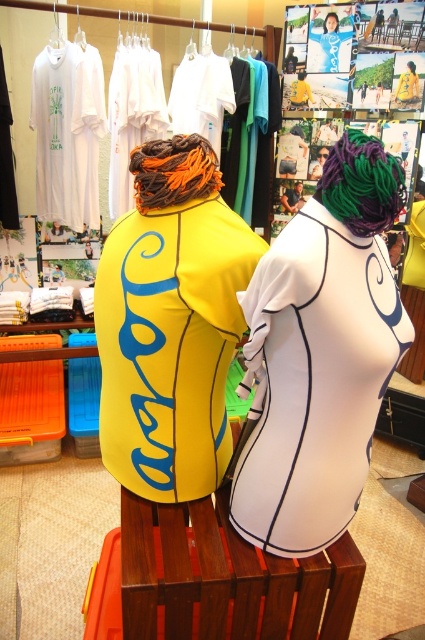
Question: Which point is closer to the camera?

Choices:
 (A) multicolored braided hair at center
 (B) purple matte hair at upper center
 (C) yellow matte wetsuit at center
 (D) white matte swimsuit at center

Answer: (D)

Question: Observing the image, what is the correct spatial positioning of white matte swimsuit at center in reference to yellow matte wetsuit at center?

Choices:
 (A) right
 (B) left

Answer: (A)

Question: In this image, where is yellow matte wetsuit at center located relative to orangehair at center?

Choices:
 (A) left
 (B) right

Answer: (B)

Question: Where is white matte swimsuit at center located in relation to orangehair at center in the image?

Choices:
 (A) right
 (B) left

Answer: (A)

Question: Which is nearer to the yellow matte wetsuit at center?

Choices:
 (A) white matte swimsuit at center
 (B) multicolored braided hair at center

Answer: (A)

Question: Which point is farther to the camera?

Choices:
 (A) orangehair at center
 (B) multicolored braided hair at center
 (C) purple matte hair at upper center
 (D) white matte swimsuit at center

Answer: (C)